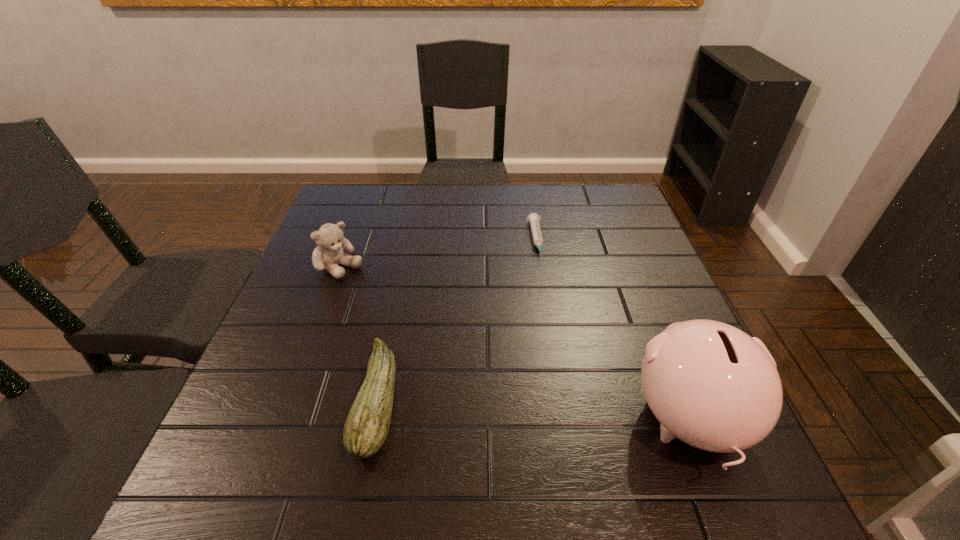
Where is `free space on the desktop that is between the zucchini and the tallest object and is positioned on the face of the leftmost object`? Image resolution: width=960 pixels, height=540 pixels. free space on the desktop that is between the zucchini and the tallest object and is positioned on the face of the leftmost object is located at coordinates (533, 410).

The width and height of the screenshot is (960, 540). In order to click on free space on the desktop that is between the second object from left to right and the rightmost object and is positioned at the needle end of the syringe in this screenshot , I will do `click(570, 413)`.